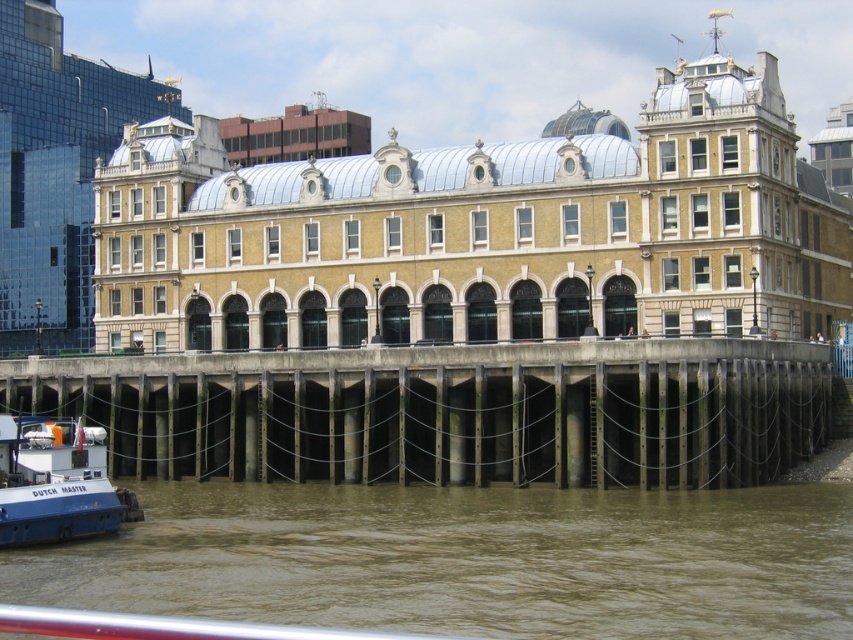
You are a delivery person trying to park your blue matte boat at lower left on the concrete dock at lower center. Based on the scene description, can your boat fit on the dock?

The concrete dock at lower center is wider than the blue matte boat at lower left, so the boat can fit on the dock.

You are standing on the concrete dock at lower center and want to see the blue matte boat at lower left. Can you see it without moving your position?

The blue matte boat at lower left is behind the concrete dock at lower center, so you cannot see it from your current position on the concrete dock at lower center.